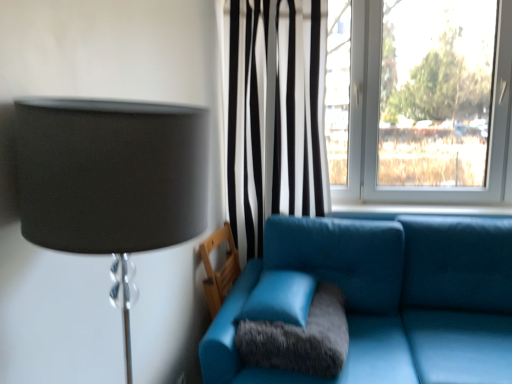
Question: Is blue fabric window sill at center smaller than black striped curtain at center?

Choices:
 (A) yes
 (B) no

Answer: (A)

Question: Considering the relative positions of blue fabric window sill at center and black striped curtain at center in the image provided, is blue fabric window sill at center to the right of black striped curtain at center from the viewer's perspective?

Choices:
 (A) no
 (B) yes

Answer: (B)

Question: Can you confirm if blue fabric window sill at center is taller than black striped curtain at center?

Choices:
 (A) yes
 (B) no

Answer: (B)

Question: Is blue fabric window sill at center further to camera compared to black striped curtain at center?

Choices:
 (A) no
 (B) yes

Answer: (B)

Question: Could you tell me if blue fabric window sill at center is facing black striped curtain at center?

Choices:
 (A) no
 (B) yes

Answer: (A)

Question: Does point (278, 276) appear closer or farther from the camera than point (269, 112)?

Choices:
 (A) farther
 (B) closer

Answer: (B)

Question: Is matte leather pillow at center spatially inside black striped curtain at center, or outside of it?

Choices:
 (A) outside
 (B) inside

Answer: (A)

Question: Considering the relative positions of matte leather pillow at center and black striped curtain at center in the image provided, is matte leather pillow at center to the left or to the right of black striped curtain at center?

Choices:
 (A) left
 (B) right

Answer: (A)

Question: Is matte leather pillow at center taller or shorter than black striped curtain at center?

Choices:
 (A) short
 (B) tall

Answer: (A)

Question: Considering the positions of matte leather pillow at center and blue fabric window sill at center in the image, is matte leather pillow at center taller or shorter than blue fabric window sill at center?

Choices:
 (A) tall
 (B) short

Answer: (A)

Question: Is matte leather pillow at center situated inside blue fabric window sill at center or outside?

Choices:
 (A) inside
 (B) outside

Answer: (B)

Question: Is matte leather pillow at center in front of or behind blue fabric window sill at center in the image?

Choices:
 (A) front
 (B) behind

Answer: (A)

Question: Based on their positions, is matte leather pillow at center located to the left or right of blue fabric window sill at center?

Choices:
 (A) right
 (B) left

Answer: (B)

Question: Is teal leather armchair at lower center inside or outside of matte black lampshade at left?

Choices:
 (A) outside
 (B) inside

Answer: (A)

Question: Based on their sizes in the image, would you say teal leather armchair at lower center is bigger or smaller than matte black lampshade at left?

Choices:
 (A) small
 (B) big

Answer: (A)